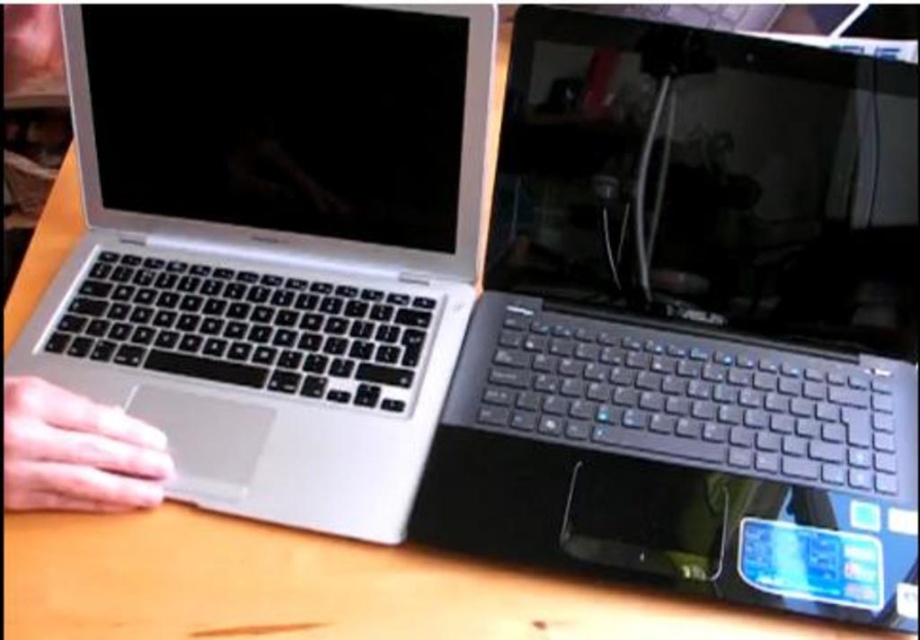
Question: Is satin black laptop at center below skinny white hand at lower left?

Choices:
 (A) no
 (B) yes

Answer: (A)

Question: Which of the following is the farthest from the observer?

Choices:
 (A) sleek silver laptop at left
 (B) satin black laptop at center
 (C) skinny white hand at lower left

Answer: (A)

Question: Which object appears farthest from the camera in this image?

Choices:
 (A) skinny white hand at lower left
 (B) sleek silver laptop at left

Answer: (B)

Question: Is satin black laptop at center smaller than sleek silver laptop at left?

Choices:
 (A) no
 (B) yes

Answer: (A)

Question: Which point is closer to the camera?

Choices:
 (A) (479, 337)
 (B) (39, 388)
 (C) (315, 211)

Answer: (B)

Question: Observing the image, what is the correct spatial positioning of sleek silver laptop at left in reference to skinny white hand at lower left?

Choices:
 (A) left
 (B) right

Answer: (B)